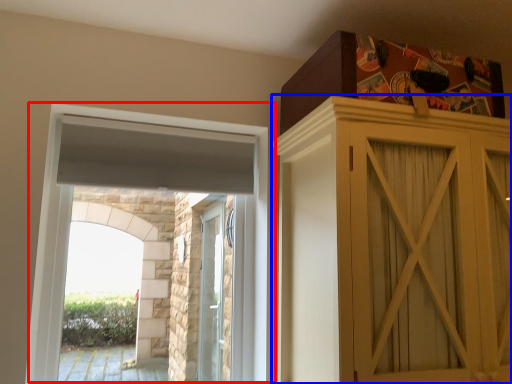
Question: Which of the following is the farthest to the observer, window (highlighted by a red box) or cupboard (highlighted by a blue box)?

Choices:
 (A) window
 (B) cupboard

Answer: (A)